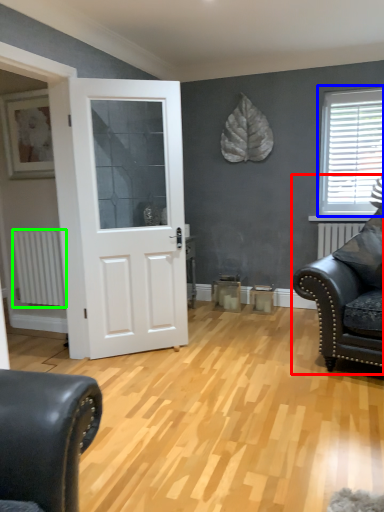
Question: Which object is the closest to the studio couch (highlighted by a red box)? Choose among these: window (highlighted by a blue box) or radiator (highlighted by a green box).

Choices:
 (A) window
 (B) radiator

Answer: (A)